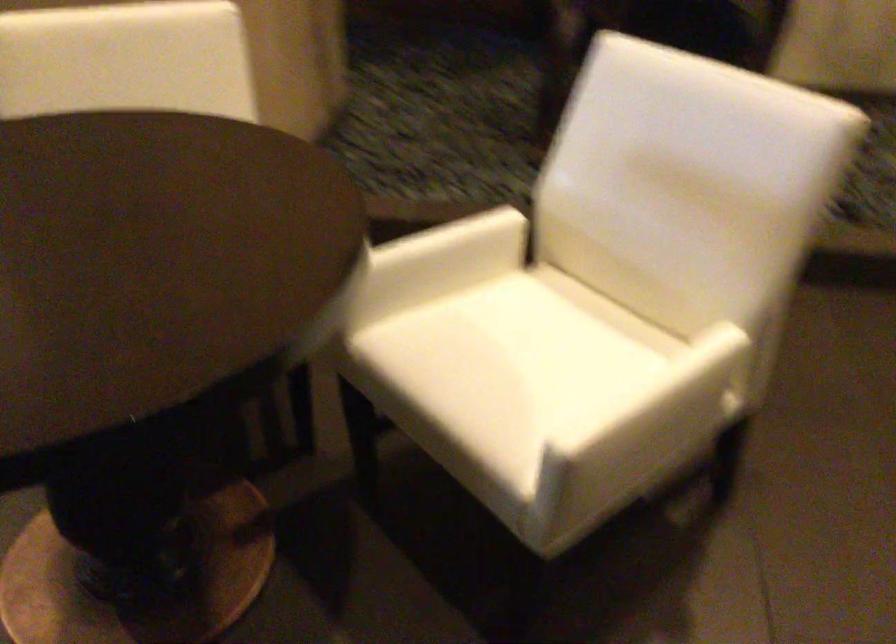
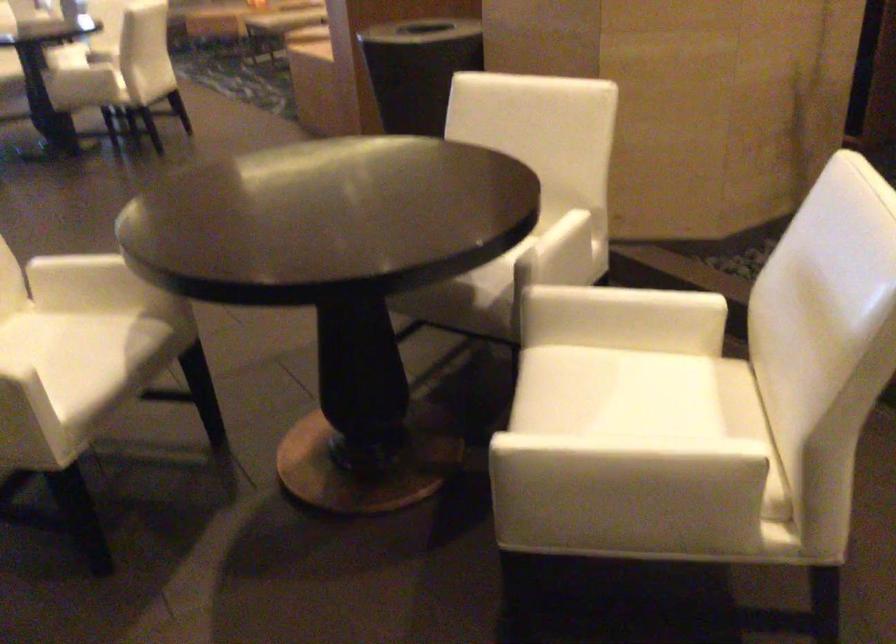
Find the pixel in the second image that matches [521,333] in the first image.

(640, 393)